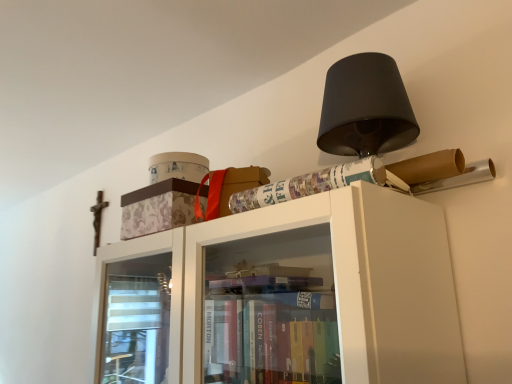
Where is `patterned cardboard box at upper center`? The image size is (512, 384). patterned cardboard box at upper center is located at coordinates (158, 208).

The height and width of the screenshot is (384, 512). Describe the element at coordinates (158, 208) in the screenshot. I see `patterned cardboard box at upper center` at that location.

What do you see at coordinates (309, 184) in the screenshot?
I see `patterned paper at upper right` at bounding box center [309, 184].

The height and width of the screenshot is (384, 512). Identify the location of patterned paper at upper right. (309, 184).

I want to click on patterned cardboard box at upper center, so click(x=158, y=208).

Is patterned cardboard box at upper center at the left side of patterned paper at upper right?

Yes.

Is patterned cardboard box at upper center in front of or behind patterned paper at upper right in the image?

In the image, patterned cardboard box at upper center appears behind patterned paper at upper right.

Does point (126, 225) appear closer or farther from the camera than point (340, 175)?

Clearly, point (126, 225) is more distant from the camera than point (340, 175).

From the image's perspective, is patterned cardboard box at upper center located above or below patterned paper at upper right?

patterned cardboard box at upper center is below patterned paper at upper right.

From a real-world perspective, who is located lower, patterned cardboard box at upper center or patterned paper at upper right?

From a 3D spatial view, patterned paper at upper right is below.

Which of these two, patterned cardboard box at upper center or patterned paper at upper right, is thinner?

With smaller width is patterned paper at upper right.

Considering the relative sizes of patterned cardboard box at upper center and patterned paper at upper right in the image provided, is patterned cardboard box at upper center taller than patterned paper at upper right?

Correct, patterned cardboard box at upper center is much taller as patterned paper at upper right.

Based on their sizes in the image, would you say patterned cardboard box at upper center is bigger or smaller than patterned paper at upper right?

Considering their sizes, patterned cardboard box at upper center takes up more space than patterned paper at upper right.

Would you say patterned cardboard box at upper center is outside patterned paper at upper right?

Yes, patterned cardboard box at upper center is located beyond the bounds of patterned paper at upper right.

Is patterned cardboard box at upper center far away from patterned paper at upper right?

That's not correct — patterned cardboard box at upper center is a little close to patterned paper at upper right.

Is patterned cardboard box at upper center oriented towards patterned paper at upper right?

No, patterned cardboard box at upper center is not facing towards patterned paper at upper right.

Measure the distance from patterned cardboard box at upper center to patterned paper at upper right.

A distance of 10.17 inches exists between patterned cardboard box at upper center and patterned paper at upper right.

You are a GUI agent. You are given a task and a screenshot of the screen. Output one action in this format:
    pyautogui.click(x=<x>, y=<y>)
    Task: Click on the paperback book on the right of patterned cardboard box at upper center
    This screenshot has height=384, width=512.
    Given the screenshot: What is the action you would take?
    pyautogui.click(x=309, y=184)

Which is more to the left, patterned paper at upper right or patterned cardboard box at upper center?

patterned cardboard box at upper center is more to the left.

Consider the image. Is patterned paper at upper right in front of patterned cardboard box at upper center?

Yes, the depth of patterned paper at upper right is less than that of patterned cardboard box at upper center.

Is point (343, 175) closer or farther from the camera than point (123, 239)?

Point (343, 175) appears to be closer to the viewer than point (123, 239).

From the image's perspective, is patterned paper at upper right above or below patterned cardboard box at upper center?

From the image's perspective, patterned paper at upper right appears above patterned cardboard box at upper center.

From a real-world perspective, is patterned paper at upper right located beneath patterned cardboard box at upper center?

Yes.

Considering the sizes of objects patterned paper at upper right and patterned cardboard box at upper center in the image provided, who is wider, patterned paper at upper right or patterned cardboard box at upper center?

With larger width is patterned cardboard box at upper center.

Is patterned paper at upper right taller than patterned cardboard box at upper center?

In fact, patterned paper at upper right may be shorter than patterned cardboard box at upper center.

Is patterned paper at upper right bigger or smaller than patterned cardboard box at upper center?

patterned paper at upper right is smaller than patterned cardboard box at upper center.

Based on the photo, would you say patterned paper at upper right is inside or outside patterned cardboard box at upper center?

patterned paper at upper right is located beyond the bounds of patterned cardboard box at upper center.

Would you consider patterned paper at upper right to be distant from patterned cardboard box at upper center?

Actually, patterned paper at upper right and patterned cardboard box at upper center are a little close together.

Is patterned paper at upper right aimed at patterned cardboard box at upper center?

No, patterned paper at upper right is not aimed at patterned cardboard box at upper center.

What's the angular difference between patterned paper at upper right and patterned cardboard box at upper center's facing directions?

0.00016 degrees.

Identify the location of cabinetry located on the left of patterned paper at upper right. The image size is (512, 384). (158, 208).

You are a GUI agent. You are given a task and a screenshot of the screen. Output one action in this format:
    pyautogui.click(x=<x>, y=<y>)
    Task: Click on the paperback book in front of the patterned cardboard box at upper center
    
    Given the screenshot: What is the action you would take?
    pyautogui.click(x=309, y=184)

The image size is (512, 384). What are the coordinates of `cabinetry below the patterned paper at upper right (from the image's perspective)` in the screenshot? It's located at (158, 208).